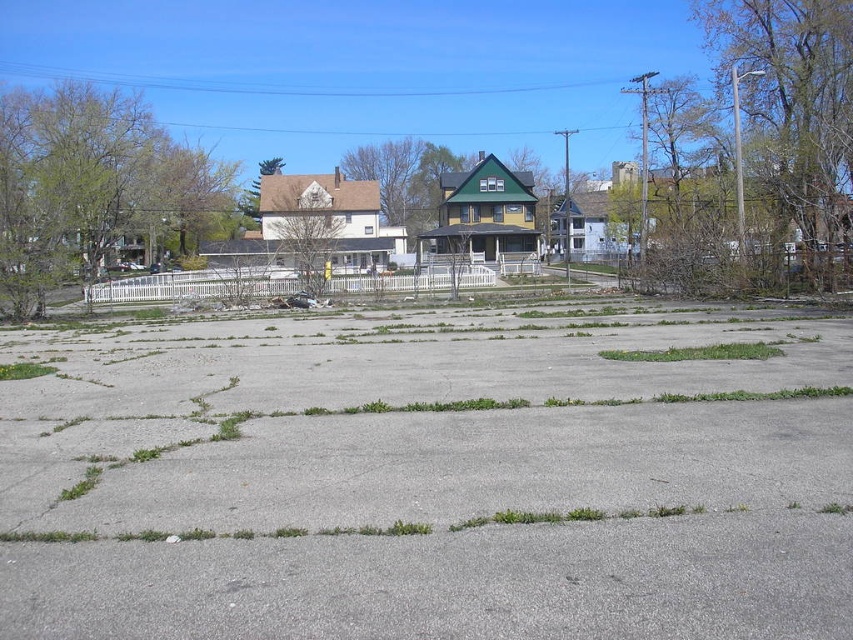
Can you confirm if gray concrete pavement at center is wider than green soft grass at lower left?

Yes, gray concrete pavement at center is wider than green soft grass at lower left.

From the picture: Does gray concrete pavement at center have a greater height compared to green soft grass at lower left?

Yes, gray concrete pavement at center is taller than green soft grass at lower left.

Find the location of a particular element. gray concrete pavement at center is located at coordinates (428, 476).

This screenshot has width=853, height=640. Describe the element at coordinates (428, 476) in the screenshot. I see `gray concrete pavement at center` at that location.

Between point (643, 410) and point (701, 355), which one is positioned behind?

The point (701, 355) is more distant.

Between point (461, 422) and point (646, 360), which one is positioned in front?

Point (461, 422) is in front.

Locate an element on the screen. gray concrete pavement at center is located at coordinates (428, 476).

Is green grass at center to the left of green soft grass at lower left from the viewer's perspective?

Incorrect, green grass at center is not on the left side of green soft grass at lower left.

Is point (694, 349) farther from viewer compared to point (15, 368)?

No, it is in front of (15, 368).

Where is `green grass at center`? green grass at center is located at coordinates [697, 353].